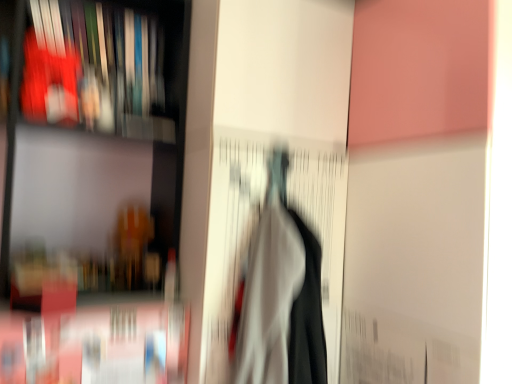
Question: In terms of width, does white fabric at center look wider or thinner when compared to matte black bookshelf at left?

Choices:
 (A) thin
 (B) wide

Answer: (A)

Question: From the image's perspective, is white fabric at center positioned above or below matte black bookshelf at left?

Choices:
 (A) above
 (B) below

Answer: (B)

Question: Considering the real-world distances, which object is closest to the white fabric at center?

Choices:
 (A) matte black bookshelf at left
 (B) matte plastic book at upper left

Answer: (A)

Question: Based on their relative distances, which object is farther from the matte plastic book at upper left?

Choices:
 (A) white fabric at center
 (B) matte black bookshelf at left

Answer: (A)